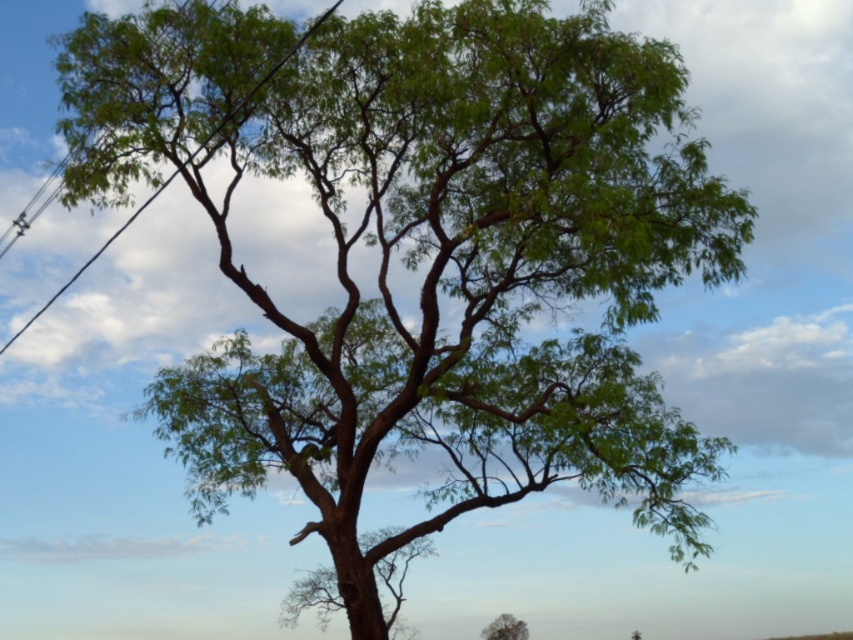
Which of these two, black wire at upper left or green leafy tree at center, stands shorter?

Standing shorter between the two is green leafy tree at center.

Is point (148, 202) in front of point (483, 637)?

Yes, point (148, 202) is in front of point (483, 637).

The image size is (853, 640). I want to click on black wire at upper left, so pos(90,260).